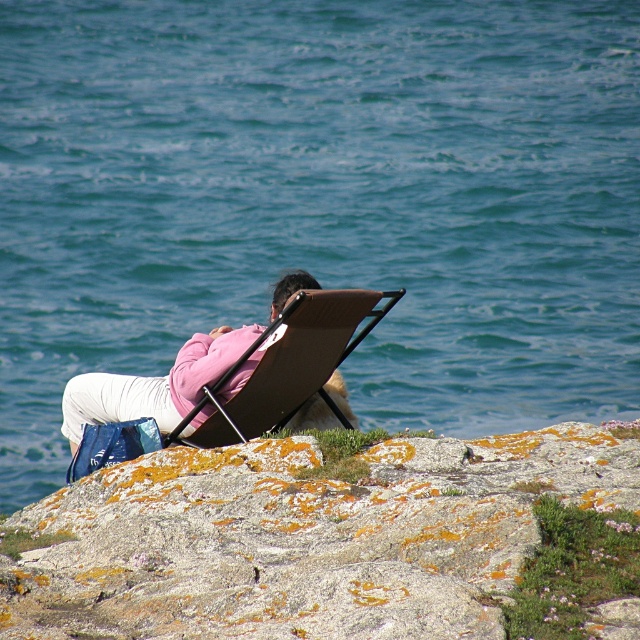
Does rocky cliff at lower right lie in front of pink fabric chair at center?

Yes.

Which is more to the left, rocky cliff at lower right or pink fabric chair at center?

From the viewer's perspective, pink fabric chair at center appears more on the left side.

Who is more forward, [195,580] or [308,419]?

Point [195,580] is in front.

Find the location of a particular element. The width and height of the screenshot is (640, 640). rocky cliff at lower right is located at coordinates (304, 538).

Can you confirm if pink fabric chair at center is positioned below brown leather chair at center?

No, pink fabric chair at center is not below brown leather chair at center.

Does pink fabric chair at center have a lesser height compared to brown leather chair at center?

Indeed, pink fabric chair at center has a lesser height compared to brown leather chair at center.

Identify the location of pink fabric chair at center. (154, 385).

Does rocky cliff at lower right have a lesser width compared to brown leather chair at center?

No, rocky cliff at lower right is not thinner than brown leather chair at center.

Which is above, rocky cliff at lower right or brown leather chair at center?

brown leather chair at center

Between point (248, 497) and point (301, 340), which one is positioned behind?

Positioned behind is point (301, 340).

Find the location of `rocky cliff at lower right`. rocky cliff at lower right is located at coordinates (304, 538).